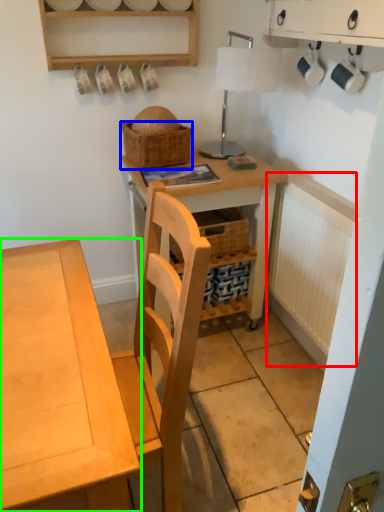
Question: Which object is the farthest from radiator (highlighted by a red box)? Choose among these: picnic basket (highlighted by a blue box) or desk (highlighted by a green box).

Choices:
 (A) picnic basket
 (B) desk

Answer: (B)